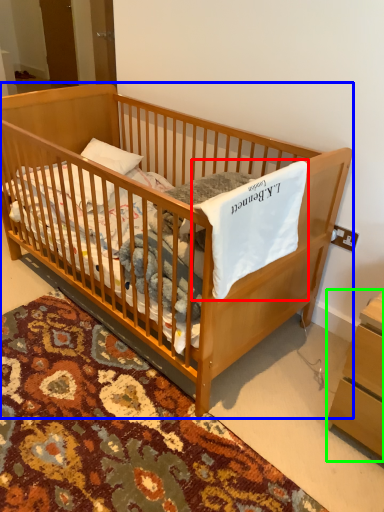
Question: Based on their relative distances, which object is farther from sheet (highlighted by a red box)? Choose from infant bed (highlighted by a blue box) and changing table (highlighted by a green box).

Choices:
 (A) infant bed
 (B) changing table

Answer: (B)